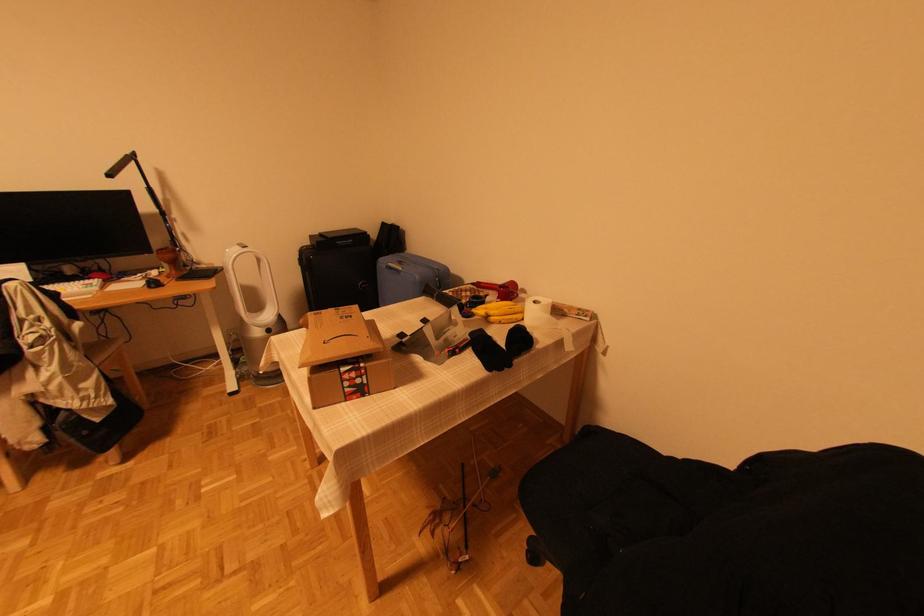
Find where to adjust the desk lamp arm. Please return your answer as a coordinate pair (x, y).

(161, 211)